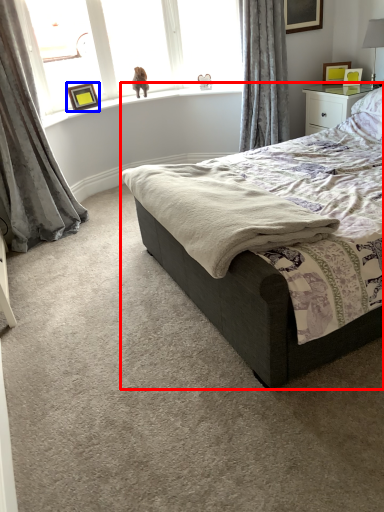
Question: Which object appears farthest to the camera in this image, bed (highlighted by a red box) or picture frame (highlighted by a blue box)?

Choices:
 (A) bed
 (B) picture frame

Answer: (B)